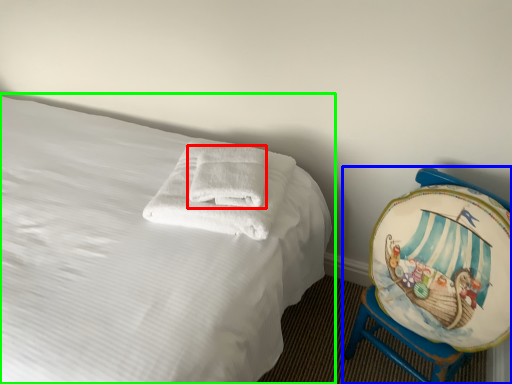
Question: Considering the real-world distances, which object is closest to bath towel (highlighted by a red box)? furniture (highlighted by a blue box) or bed (highlighted by a green box).

Choices:
 (A) furniture
 (B) bed

Answer: (B)